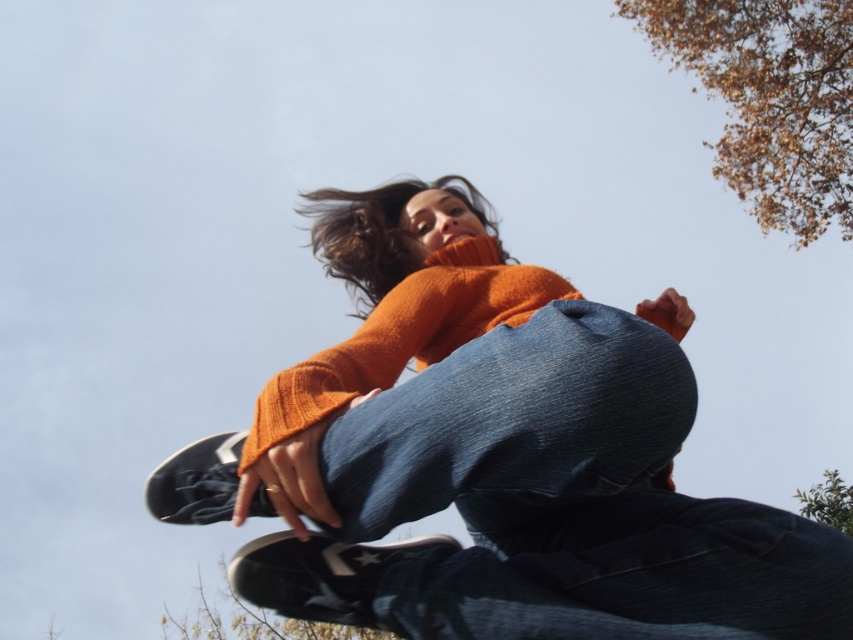
Question: Is denim at center thinner than green leafy tree at upper right?

Choices:
 (A) no
 (B) yes

Answer: (B)

Question: Does denim at center lie in front of brown textured leaves at lower left?

Choices:
 (A) no
 (B) yes

Answer: (B)

Question: Among these objects, which one is nearest to the camera?

Choices:
 (A) orange knitted sweater at center
 (B) brown leafy branches at upper right

Answer: (A)

Question: Does orange knitted sweater at center have a larger size compared to brown leafy branches at upper right?

Choices:
 (A) no
 (B) yes

Answer: (A)

Question: Which point is closer to the camera taking this photo?

Choices:
 (A) (836, 516)
 (B) (474, 454)

Answer: (B)

Question: Which point is closer to the camera?

Choices:
 (A) brown textured leaves at lower left
 (B) denim at center

Answer: (B)